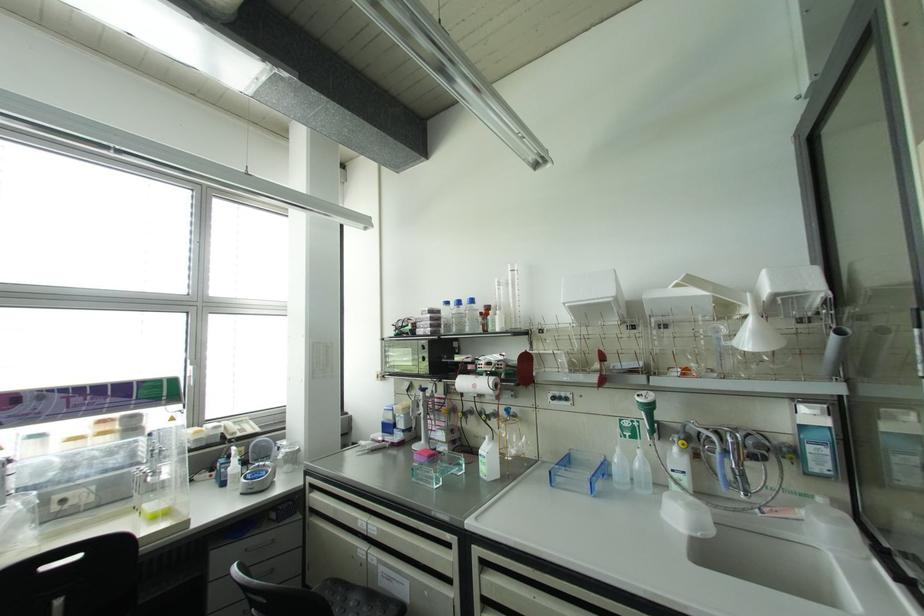
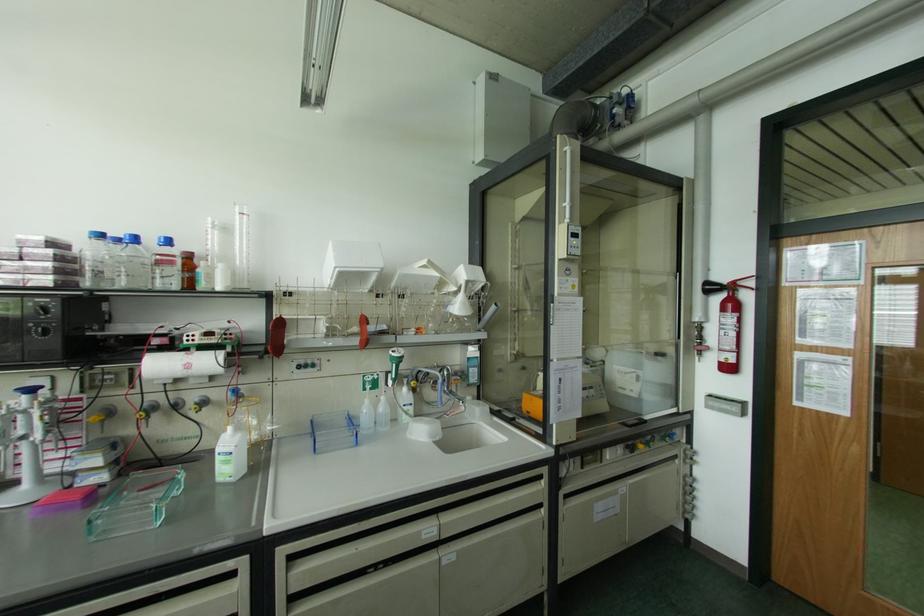
The point at (x=473, y=386) is marked in the first image. Where is the corresponding point in the second image?

(188, 366)